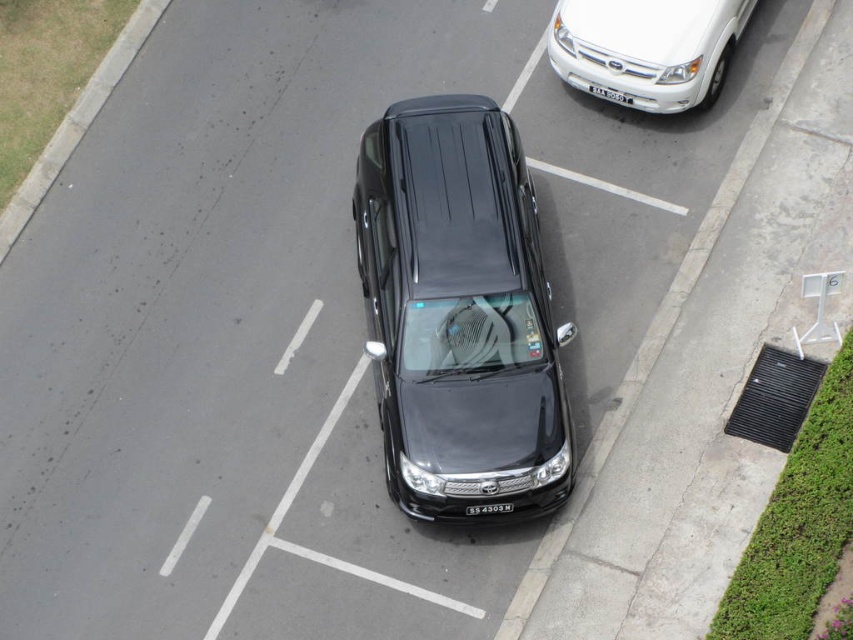
In the scene shown: You are a parking attendant checking if vehicles are properly aligned. You see the white glossy suv at upper right and the white plastic license plate at center. Which vehicle is positioned more to the right side of the parking area?

The white glossy suv at upper right is positioned more to the right side of the parking area than the white plastic license plate at center.

You are a parking attendant checking the alignment of vehicles. You notice the white glossy suv at upper right and the white plastic license plate at center. Which object is positioned higher up in the image?

The white glossy suv at upper right is located above the white plastic license plate at center in the image.